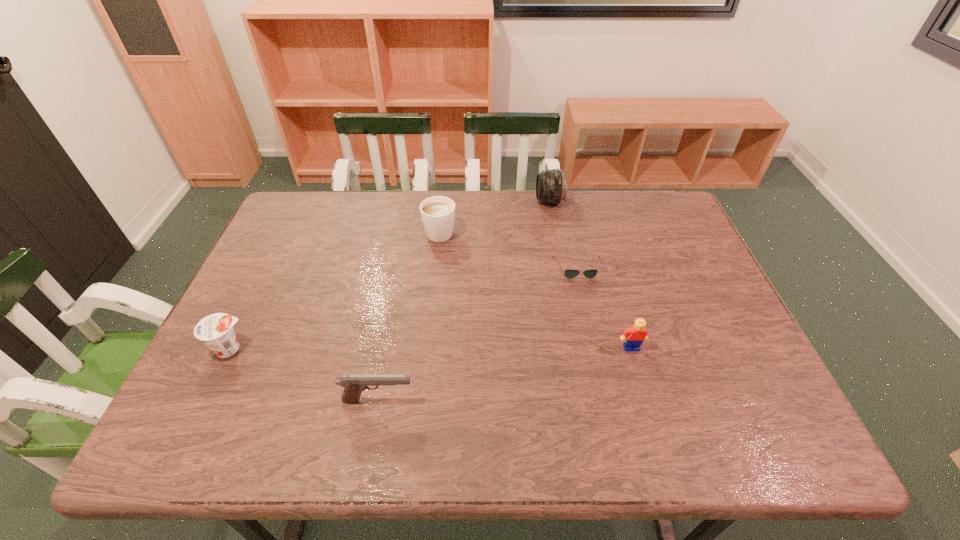
In the image, there is a desktop. Where is `free region at the far edge`? This screenshot has height=540, width=960. free region at the far edge is located at coordinates (503, 213).

In order to click on vacant region at the near edge of the desktop in this screenshot , I will do `click(588, 426)`.

In the image, there is a desktop. In order to click on vacant space at the left edge in this screenshot , I will do `click(274, 266)`.

The width and height of the screenshot is (960, 540). In order to click on free space at the right edge of the desktop in this screenshot , I will do `click(714, 325)`.

Locate an element on the screen. free space at the far right corner is located at coordinates (653, 228).

This screenshot has width=960, height=540. Find the location of `vacant space at the near right corner of the desktop`. vacant space at the near right corner of the desktop is located at coordinates (776, 446).

Identify the location of vacant space in between the nearest object and the cappuccino. (409, 315).

You are a GUI agent. You are given a task and a screenshot of the screen. Output one action in this format:
    pyautogui.click(x=<x>, y=<y>)
    Task: Click on the empty space that is in between the farthest object and the cappuccino
    The height and width of the screenshot is (540, 960).
    Given the screenshot: What is the action you would take?
    pyautogui.click(x=494, y=215)

This screenshot has height=540, width=960. I want to click on empty location between the cappuccino and the Lego, so click(536, 289).

The width and height of the screenshot is (960, 540). Find the location of `empty location between the sunglasses and the telephoto lens`. empty location between the sunglasses and the telephoto lens is located at coordinates (564, 234).